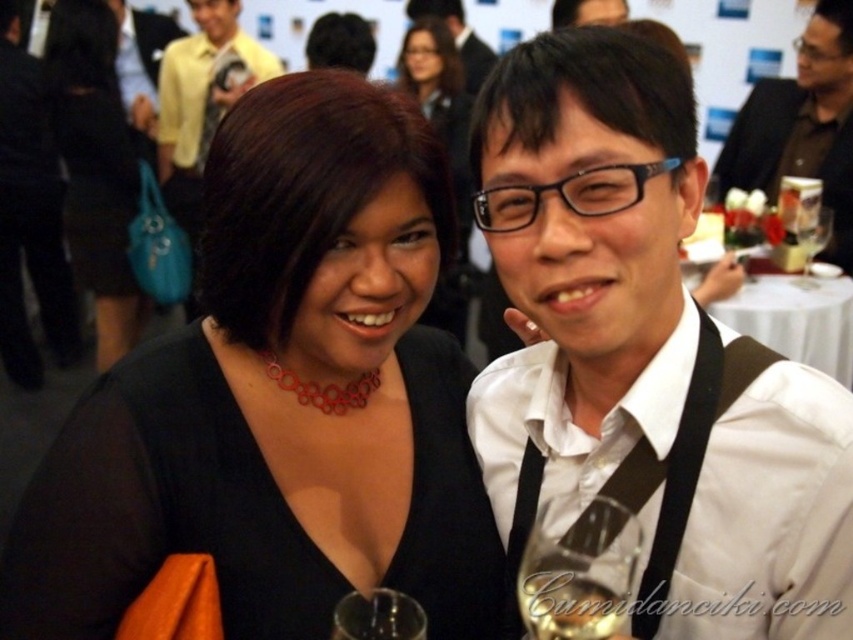
Is point (610, 598) closer to viewer compared to point (831, 230)?

Yes, it is in front of point (831, 230).

Is clear glass wine glass at center positioned at the back of transparent glass wine glass at right?

No, clear glass wine glass at center is in front of transparent glass wine glass at right.

Describe the element at coordinates (578, 568) in the screenshot. I see `clear glass wine glass at center` at that location.

In order to click on clear glass wine glass at center in this screenshot , I will do `click(578, 568)`.

Which is above, black fabric dress at center or brown leather jacket at upper right?

black fabric dress at center

Is black fabric dress at center to the right of brown leather jacket at upper right from the viewer's perspective?

Incorrect, black fabric dress at center is not on the right side of brown leather jacket at upper right.

The height and width of the screenshot is (640, 853). Describe the element at coordinates (96, 168) in the screenshot. I see `black fabric dress at center` at that location.

Identify the location of black fabric dress at center. (96, 168).

Does yellow shirt at upper left have a smaller size compared to transparent glass wine glass at right?

No, yellow shirt at upper left is not smaller than transparent glass wine glass at right.

Between yellow shirt at upper left and transparent glass wine glass at right, which one appears on the left side from the viewer's perspective?

Positioned to the left is yellow shirt at upper left.

Does point (234, 49) come in front of point (815, 216)?

No, (234, 49) is behind (815, 216).

You are a GUI agent. You are given a task and a screenshot of the screen. Output one action in this format:
    pyautogui.click(x=<x>, y=<y>)
    Task: Click on the yellow shirt at upper left
    This screenshot has height=640, width=853.
    Given the screenshot: What is the action you would take?
    pyautogui.click(x=201, y=99)